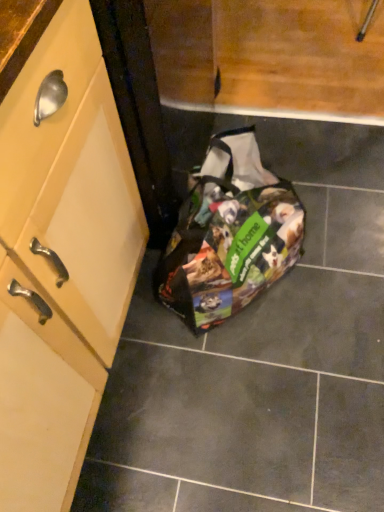
Where is `printed fabric bag at lower center`? This screenshot has height=512, width=384. printed fabric bag at lower center is located at coordinates (229, 234).

The image size is (384, 512). What do you see at coordinates (229, 234) in the screenshot? I see `printed fabric bag at lower center` at bounding box center [229, 234].

This screenshot has width=384, height=512. What are the coordinates of `printed fabric bag at lower center` in the screenshot? It's located at (229, 234).